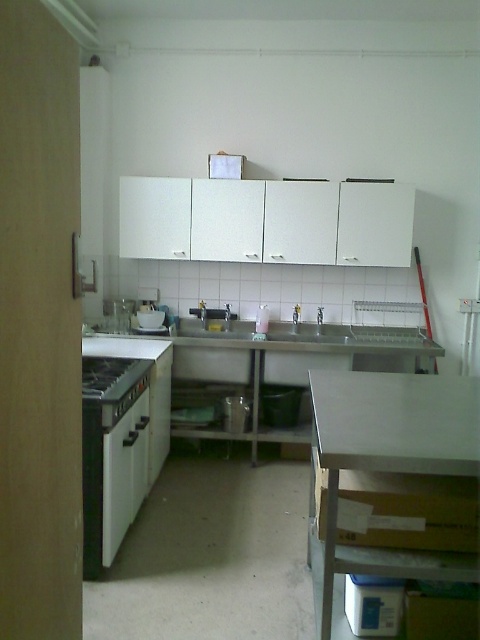
Question: Among these points, which one is farthest from the camera?

Choices:
 (A) (129, 406)
 (B) (206, 364)

Answer: (B)

Question: Based on their relative distances, which object is farther from the satin silver sink at center?

Choices:
 (A) black matte oven at left
 (B) black matte stove at lower left
 (C) stainless steel counter top at center

Answer: (A)

Question: Can you confirm if black matte oven at left is bigger than black matte stove at lower left?

Choices:
 (A) yes
 (B) no

Answer: (A)

Question: Does stainless steel counter top at center have a greater width compared to black matte oven at left?

Choices:
 (A) yes
 (B) no

Answer: (A)

Question: Which point appears closest to the camera in this image?

Choices:
 (A) (288, 376)
 (B) (93, 440)
 (C) (104, 400)
 (D) (240, 328)

Answer: (B)

Question: Is stainless steel counter top at center bigger than satin silver sink at center?

Choices:
 (A) no
 (B) yes

Answer: (B)